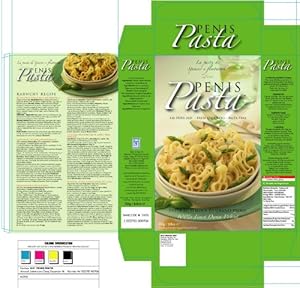
The image size is (300, 288). What are the coordinates of `plate` in the screenshot? It's located at (258, 197), (110, 87).